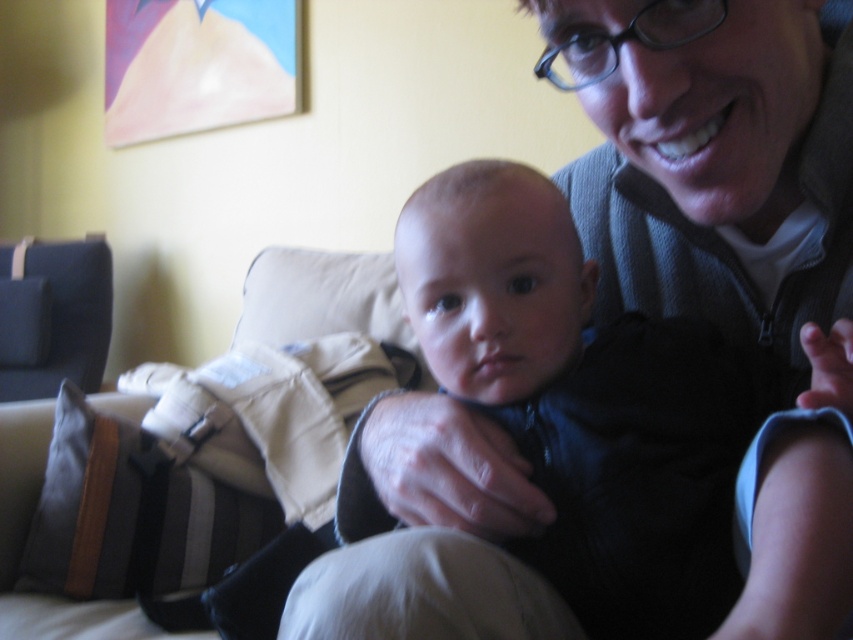
Based on the photo, you are a photographer setting up a shoot in the living room. You need to position a light source between the dark blue fabric baby at center and the dark blue fabric armchair at left. Based on their positions, which object should the light be placed closer to?

The light source should be placed closer to the dark blue fabric baby at center because it is closer to the viewer than the dark blue fabric armchair at left.

You are an interior designer assessing the living room layout. You notice the dark blue fabric baby at center and the dark blue fabric armchair at left. Which object has a greater height?

The dark blue fabric armchair at left has a greater height than the dark blue fabric baby at center.